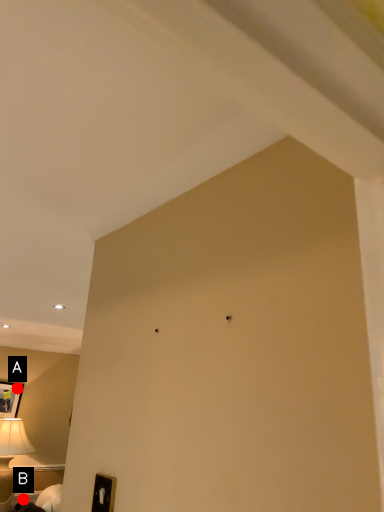
Question: Two points are circled on the image, labeled by A and B beside each circle. Which point is further to the camera?

Choices:
 (A) A is further
 (B) B is further

Answer: (A)